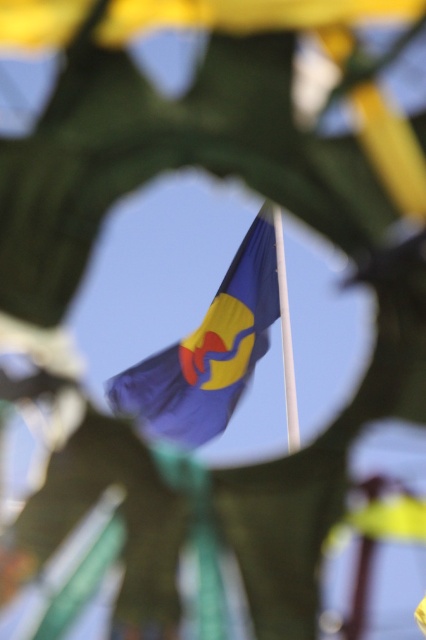
Does blue fabric flag at center appear over white smooth pole at center?

Correct, blue fabric flag at center is located above white smooth pole at center.

Who is positioned more to the right, blue fabric flag at center or white smooth pole at center?

white smooth pole at center

Where is `blue fabric flag at center`? The width and height of the screenshot is (426, 640). blue fabric flag at center is located at coordinates (218, 349).

The image size is (426, 640). In order to click on blue fabric flag at center in this screenshot , I will do `click(218, 349)`.